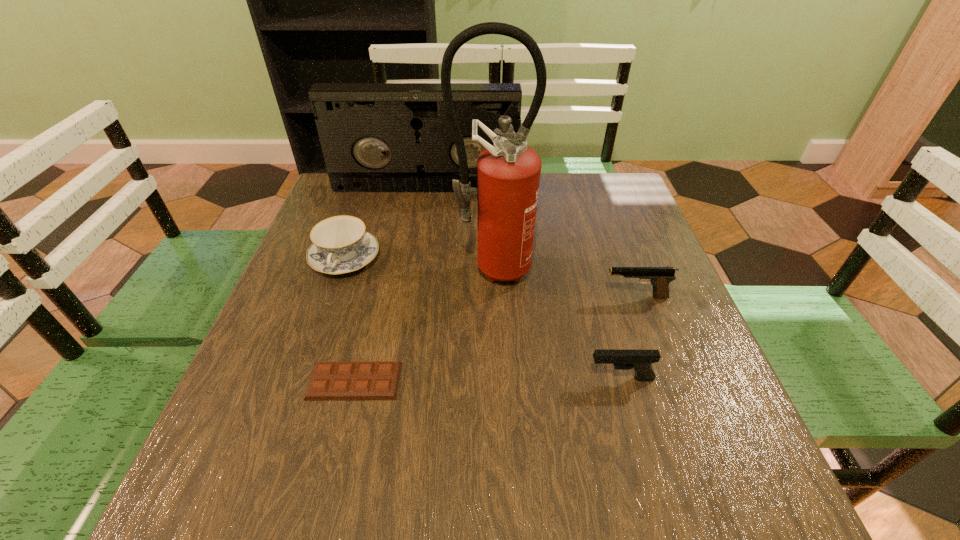
Where is `unoccupied area between the shortest object and the fire extinguisher`? Image resolution: width=960 pixels, height=540 pixels. unoccupied area between the shortest object and the fire extinguisher is located at coordinates (422, 325).

Locate an element on the screen. free point between the nearer pistol and the videotape is located at coordinates (523, 283).

The width and height of the screenshot is (960, 540). In order to click on free space between the fire extinguisher and the second tallest object in this screenshot , I will do `click(458, 228)`.

The height and width of the screenshot is (540, 960). Identify the location of object that is the third closest to the nearer pistol. (330, 380).

Identify which object is the second nearest to the nearer pistol. Please provide its 2D coordinates. Your answer should be formatted as a tuple, i.e. [(x, y)], where the tuple contains the x and y coordinates of a point satisfying the conditions above.

[(508, 173)]

The image size is (960, 540). Find the location of `free region that satisfies the following two spatial constraints: 1. with the handle on the side of the shortest object; 2. on the left side of the chinaware`. free region that satisfies the following two spatial constraints: 1. with the handle on the side of the shortest object; 2. on the left side of the chinaware is located at coordinates (303, 381).